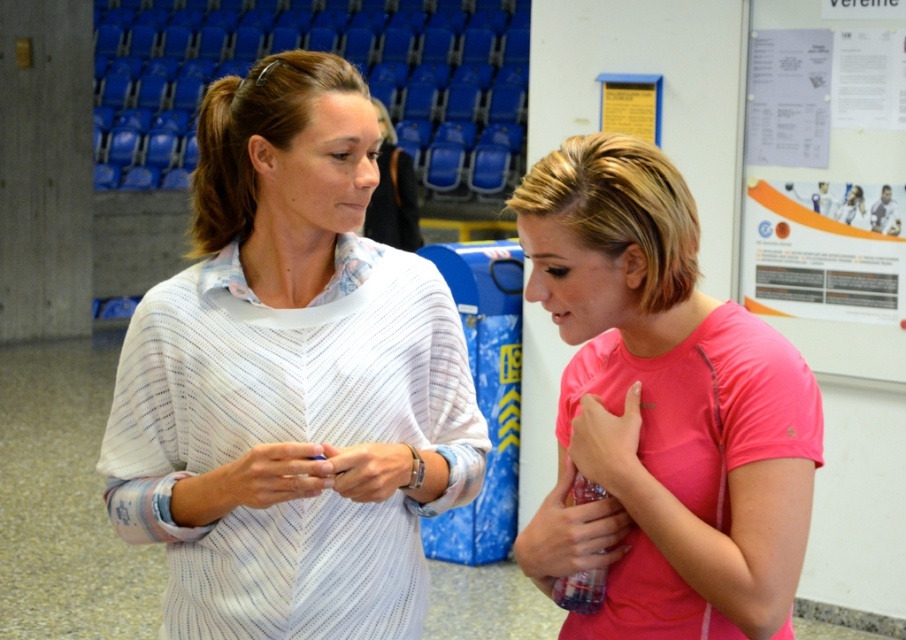
Question: Estimate the real-world distances between objects in this image. Which object is closer to the matte plastic ring at center?

Choices:
 (A) pink fabric hand at center
 (B) transparent plastic bottle at right
 (C) pink matte shirt at center

Answer: (B)

Question: Based on their relative distances, which object is nearer to the pink fabric hand at center?

Choices:
 (A) pink matte shirt at center
 (B) transparent plastic bottle at right
 (C) white textured shirt at center

Answer: (B)

Question: Is white textured shirt at center positioned at the back of matte white wristband at center?

Choices:
 (A) yes
 (B) no

Answer: (A)

Question: Among these points, which one is nearest to the camera?

Choices:
 (A) (690, 237)
 (B) (590, 552)

Answer: (A)

Question: Is pink matte shirt at center below matte plastic ring at center?

Choices:
 (A) yes
 (B) no

Answer: (B)

Question: Does pink matte shirt at center appear on the left side of matte white wristband at center?

Choices:
 (A) yes
 (B) no

Answer: (B)